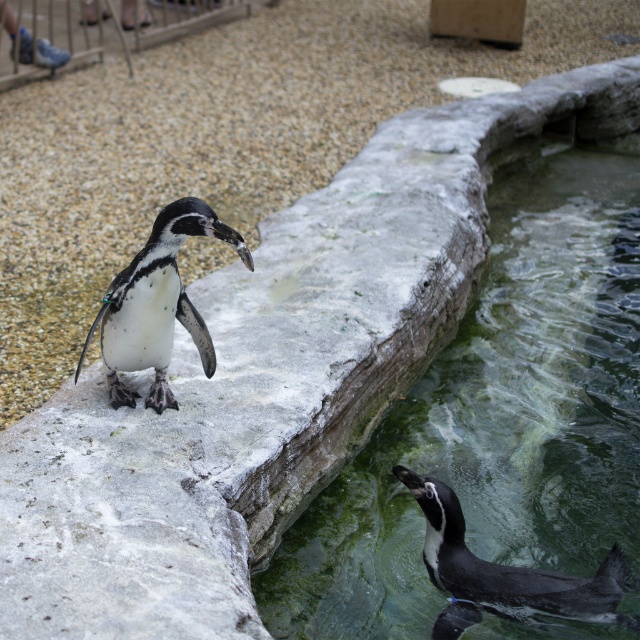
The height and width of the screenshot is (640, 640). What do you see at coordinates (497, 419) in the screenshot? I see `green mossy rock at lower center` at bounding box center [497, 419].

Is point (573, 461) farther from camera compared to point (444, 529)?

Yes, point (573, 461) is farther from viewer.

What are the coordinates of `green mossy rock at lower center` in the screenshot? It's located at pyautogui.click(x=497, y=419).

Is white matte penguin at center positioned behind black glossy penguin at lower right?

No.

Who is lower down, white matte penguin at center or black glossy penguin at lower right?

black glossy penguin at lower right

Which is behind, point (157, 404) or point (464, 564)?

Positioned behind is point (157, 404).

In order to click on white matte penguin at center in this screenshot , I will do `click(156, 305)`.

Is point (486, 618) positioned before point (113, 314)?

That is True.

Looking at this image, which of these two, green mossy rock at lower center or white matte penguin at center, stands taller?

Standing taller between the two is green mossy rock at lower center.

Identify the location of green mossy rock at lower center. This screenshot has width=640, height=640. (497, 419).